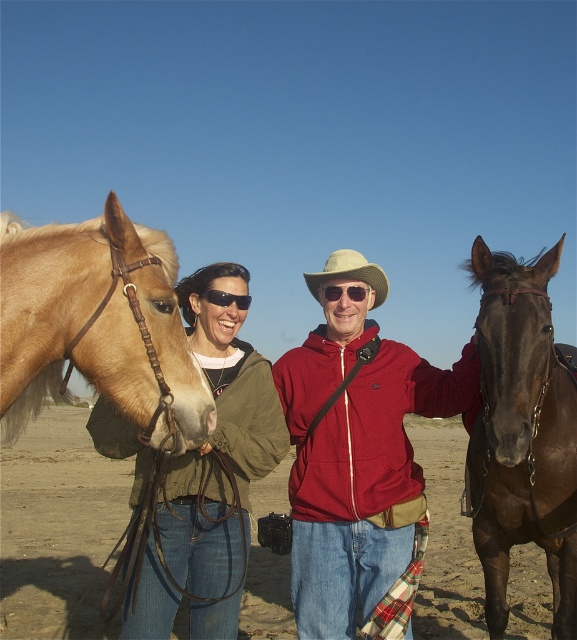
Does dull brown dirt at center appear on the right side of matte red hoodie at center?

Yes, dull brown dirt at center is to the right of matte red hoodie at center.

Which is behind, point (31, 618) or point (403, 504)?

Point (31, 618)

The height and width of the screenshot is (640, 577). Identify the location of dull brown dirt at center. (55, 518).

Does matte red hoodie at center have a greater height compared to sunglasses at center?

Indeed, matte red hoodie at center has a greater height compared to sunglasses at center.

Is matte red hoodie at center positioned behind sunglasses at center?

No, it is not.

Who is more forward, (x=339, y=616) or (x=346, y=296)?

Point (x=339, y=616) is more forward.

You are a GUI agent. You are given a task and a screenshot of the screen. Output one action in this format:
    pyautogui.click(x=<x>, y=<y>)
    Task: Click on the matte red hoodie at center
    This screenshot has height=640, width=577.
    Given the screenshot: What is the action you would take?
    pyautogui.click(x=357, y=451)

Between light brown leather horse at left and beige fabric cowboy hat at center, which one is positioned lower?

light brown leather horse at left is lower down.

Can you confirm if light brown leather horse at left is shorter than beige fabric cowboy hat at center?

No, light brown leather horse at left is not shorter than beige fabric cowboy hat at center.

Is point (16, 360) closer to viewer compared to point (346, 268)?

Yes.

Locate an element on the screen. The image size is (577, 640). light brown leather horse at left is located at coordinates (95, 321).